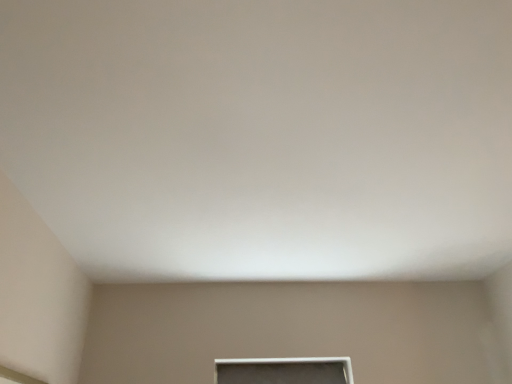
What do you see at coordinates (284, 371) in the screenshot? I see `white glossy window at lower center` at bounding box center [284, 371].

Locate an element on the screen. The width and height of the screenshot is (512, 384). white glossy window at lower center is located at coordinates (284, 371).

The image size is (512, 384). Find the location of `white glossy window at lower center`. white glossy window at lower center is located at coordinates (284, 371).